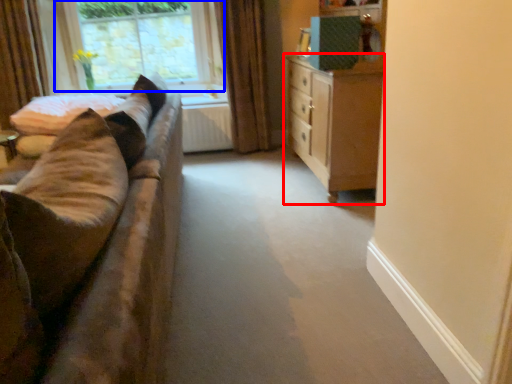
Question: Which of the following is the closest to the observer, chest of drawers (highlighted by a red box) or window (highlighted by a blue box)?

Choices:
 (A) chest of drawers
 (B) window

Answer: (A)